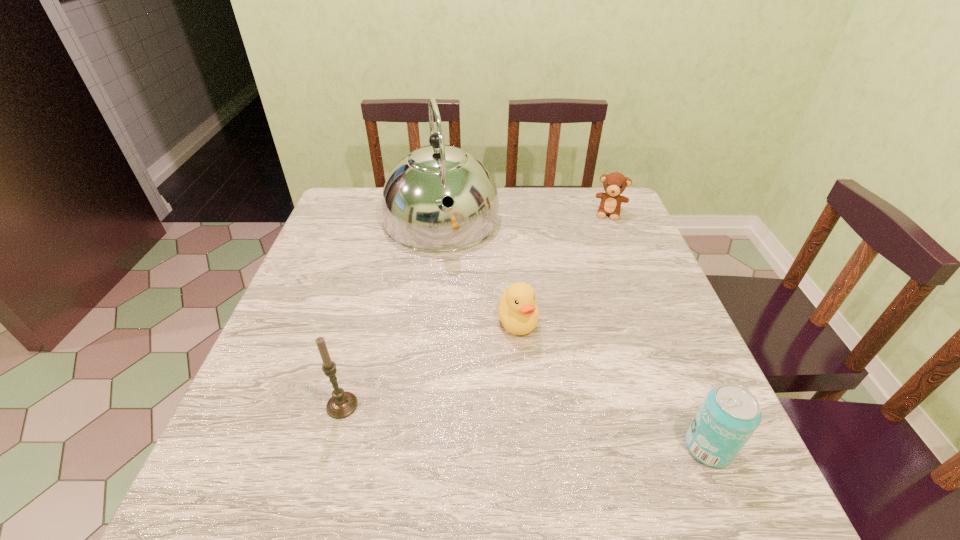
Find the location of `beer can at the near edge`. beer can at the near edge is located at coordinates (729, 415).

Find the location of a particular element. The image size is (960, 540). beer can present at the right edge is located at coordinates click(729, 415).

I want to click on teddy bear that is at the right edge, so click(x=614, y=184).

The height and width of the screenshot is (540, 960). Find the location of `object situated at the far right corner`. object situated at the far right corner is located at coordinates (614, 184).

You are a GUI agent. You are given a task and a screenshot of the screen. Output one action in this format:
    pyautogui.click(x=<x>, y=<y>)
    Task: Click on the object that is positioned at the near right corner
    The image size is (960, 540).
    Given the screenshot: What is the action you would take?
    pyautogui.click(x=729, y=415)

Locate an element on the screen. Image resolution: width=960 pixels, height=540 pixels. vacant space at the far edge of the desktop is located at coordinates (574, 211).

I want to click on vacant region at the near edge, so click(578, 441).

At what (x,y) coordinates should I click in order to perform the action: click on vacant space at the left edge. Please return your answer as a coordinate pair (x, y). This screenshot has height=540, width=960. Looking at the image, I should click on (321, 327).

Identify the location of vacant space at the right edge of the desktop. The height and width of the screenshot is (540, 960). (628, 354).

In the image, there is a desktop. At what (x,y) coordinates should I click in order to perform the action: click on free space at the far left corner. Please return your answer as a coordinate pair (x, y). Looking at the image, I should click on (347, 188).